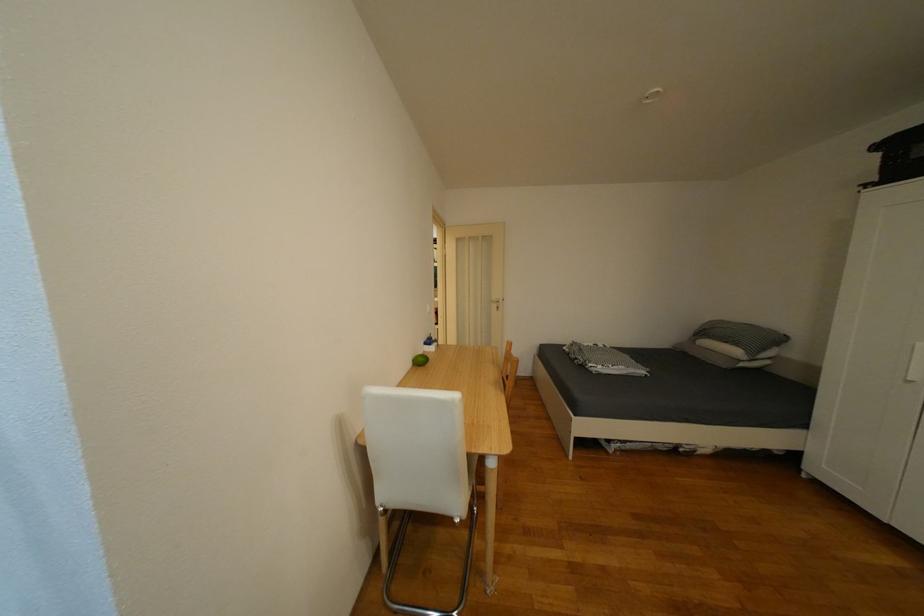
Where would you pull the silver door handle? Please return your answer as a coordinate pair (x, y).

(495, 302)